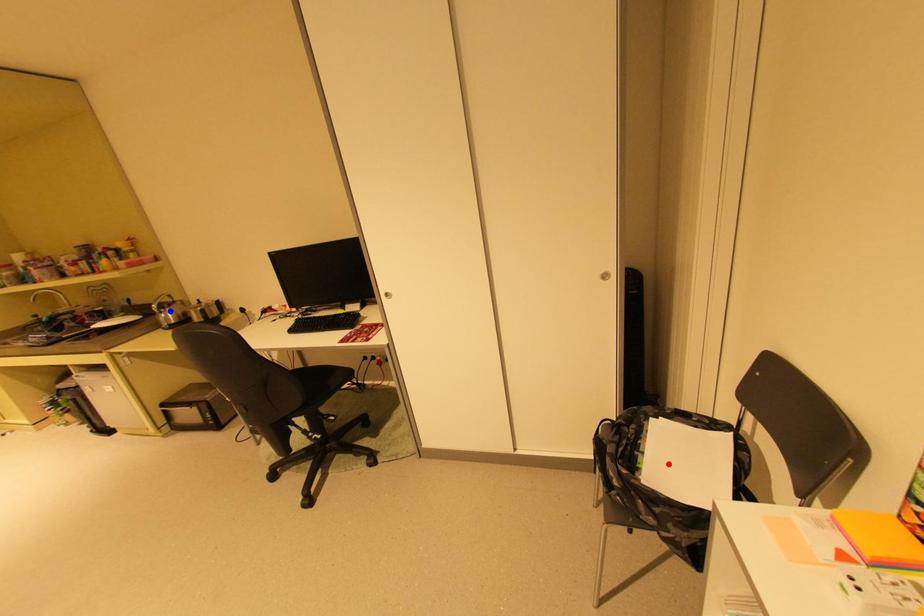
Question: In the image, two points are highlighted. Which point is nearer to the camera? Reply with the corresponding letter.

Choices:
 (A) blue point
 (B) red point

Answer: (B)